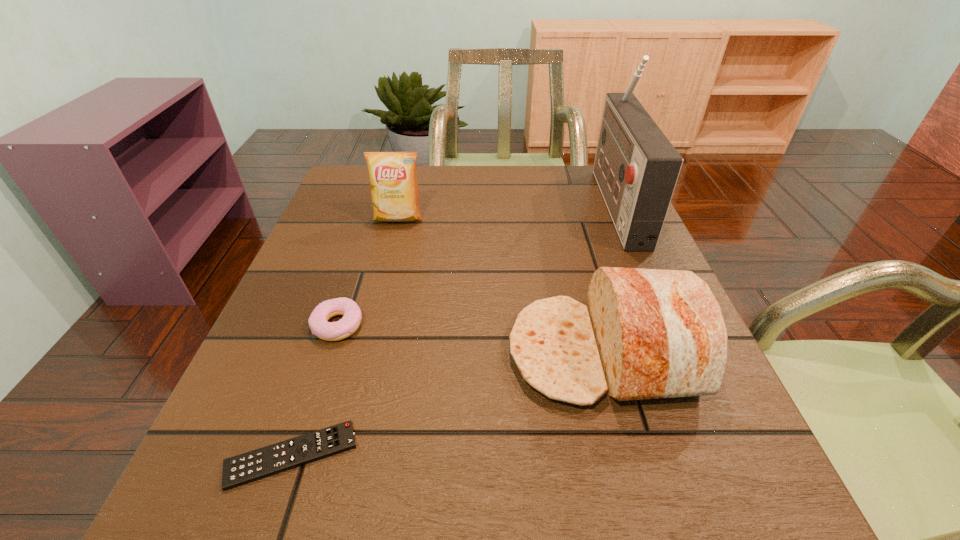
This screenshot has width=960, height=540. In the image, there is a desktop. Find the location of `vacant space at the far left corner`. vacant space at the far left corner is located at coordinates (355, 205).

The height and width of the screenshot is (540, 960). I want to click on vacant space at the far right corner of the desktop, so click(575, 200).

Where is `blank region between the second shortest object and the tallest object`? Image resolution: width=960 pixels, height=540 pixels. blank region between the second shortest object and the tallest object is located at coordinates (477, 264).

Find the location of a particular element. Image resolution: width=960 pixels, height=540 pixels. blank region between the nearest object and the radio receiver is located at coordinates tap(454, 329).

The height and width of the screenshot is (540, 960). I want to click on free space between the nearest object and the tallest object, so click(x=454, y=329).

The height and width of the screenshot is (540, 960). Find the location of `blank region between the shortest object and the bread`. blank region between the shortest object and the bread is located at coordinates (447, 404).

Where is `vacant space that's between the nearest object and the radio receiver`? vacant space that's between the nearest object and the radio receiver is located at coordinates (454, 329).

Find the location of a particular element. The image size is (960, 540). vacant space in between the crisp (potato chip) and the doughnut is located at coordinates (368, 272).

Identify the location of vacant space in between the bread and the crisp (potato chip). The height and width of the screenshot is (540, 960). (501, 286).

Where is `object that stands as the closest to the bread`? This screenshot has width=960, height=540. object that stands as the closest to the bread is located at coordinates (636, 167).